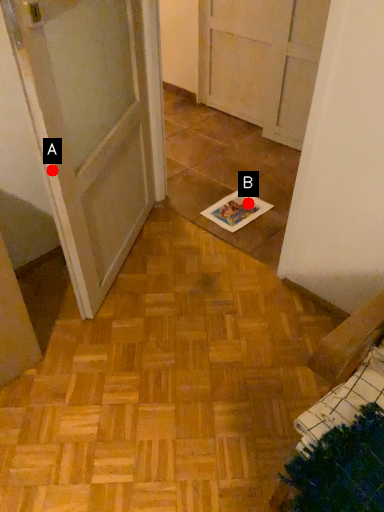
Question: Two points are circled on the image, labeled by A and B beside each circle. Among these points, which one is farthest from the camera?

Choices:
 (A) A is further
 (B) B is further

Answer: (B)